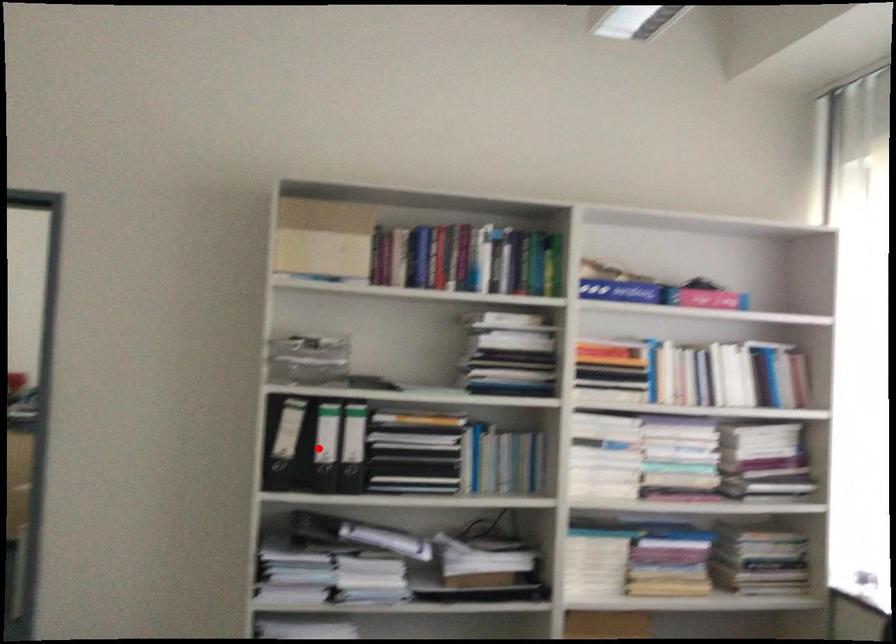
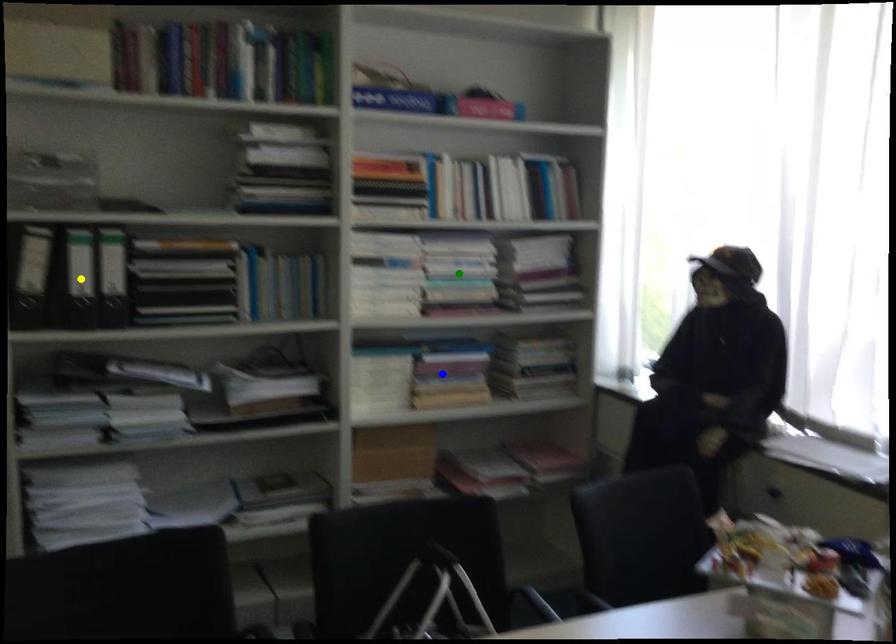
Question: I am providing you with two images of the same scene from different viewpoints. A red point is marked on the first image. You are given multiple points on the second image. Can you choose the point in image 2 that corresponds to the point in image 1?

Choices:
 (A) yellow point
 (B) green point
 (C) blue point

Answer: (A)